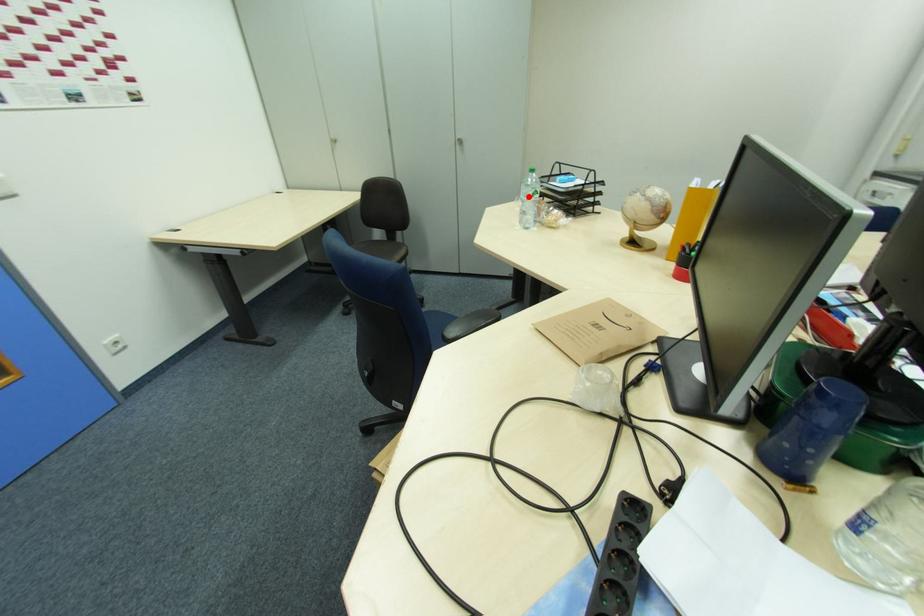
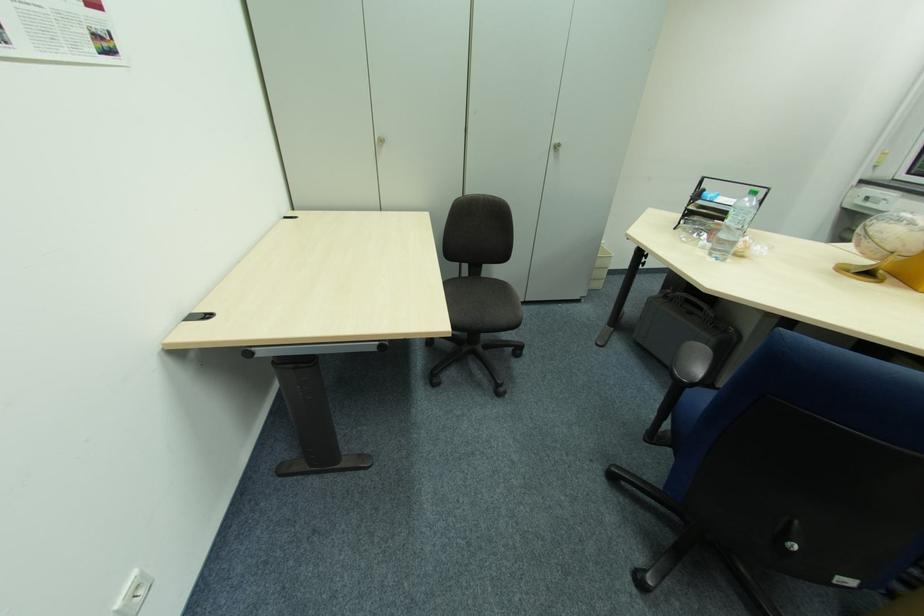
Question: I am providing you with two images of the same scene from different viewpoints. In image1, a red point is highlighted. Considering the same 3D point in image2, which of the following is correct?

Choices:
 (A) It is closer
 (B) It is farther

Answer: (B)